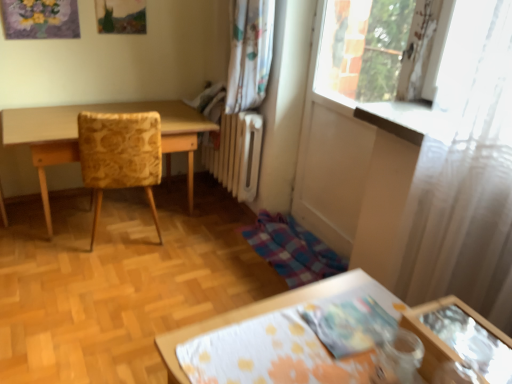
In order to face white sheer curtain at right, should I rotate leftwards or rightwards?

Turn right by 26.500 degrees to look at white sheer curtain at right.

Find the location of a particular element. The width and height of the screenshot is (512, 384). light wood table at left is located at coordinates (77, 135).

This screenshot has height=384, width=512. What are the coordinates of `yellow floral fabric chair at left` in the screenshot? It's located at (120, 154).

Considering the relative sizes of yellow floral fabric chair at left and white sheer curtain at right in the image provided, is yellow floral fabric chair at left thinner than white sheer curtain at right?

Incorrect, the width of yellow floral fabric chair at left is not less than that of white sheer curtain at right.

Which is closer, [152,153] or [510,92]?

Positioned in front is point [510,92].

Is yellow floral fabric chair at left facing towards white sheer curtain at right?

No, yellow floral fabric chair at left is not oriented towards white sheer curtain at right.

Which is correct: yellow floral fabric chair at left is inside white sheer curtain at right, or outside of it?

yellow floral fabric chair at left is spatially situated outside white sheer curtain at right.

From the image's perspective, is yellow floral fabric chair at left above or below light wood table at left?

Clearly, from the image's perspective, yellow floral fabric chair at left is below light wood table at left.

Is yellow floral fabric chair at left to the left of light wood table at left from the viewer's perspective?

No, yellow floral fabric chair at left is not to the left of light wood table at left.

Does point (155, 126) come in front of point (179, 131)?

That is True.

Is yellow floral fabric chair at left aimed at light wood table at left?

Yes, yellow floral fabric chair at left is facing light wood table at left.

Which of these two, light wood table at left or yellow floral fabric chair at left, is smaller?

yellow floral fabric chair at left.

The image size is (512, 384). There is a light wood table at left. Identify the location of chair above it (from a real-world perspective). (120, 154).

Could you tell me if light wood table at left is facing yellow floral fabric chair at left?

Yes, light wood table at left is aimed at yellow floral fabric chair at left.

Is white sheer curtain at right looking in the opposite direction of yellow floral fabric chair at left?

No.

Can you tell me how much white sheer curtain at right and yellow floral fabric chair at left differ in facing direction?

101 degrees.

Does white sheer curtain at right touch yellow floral fabric chair at left?

No, white sheer curtain at right is not touching yellow floral fabric chair at left.

Is light wood table at left positioned with its back to white sheer curtain at right?

No, light wood table at left is not facing away from white sheer curtain at right.

Which object is positioned more to the left, light wood table at left or white sheer curtain at right?

Positioned to the left is light wood table at left.

Do you think light wood table at left is within white sheer curtain at right, or outside of it?

light wood table at left lies outside white sheer curtain at right.

Would you say light wood table at left is a long distance from white sheer curtain at right?

light wood table at left is positioned a significant distance from white sheer curtain at right.

Does point (419, 249) come closer to viewer compared to point (55, 128)?

Yes, it is in front of point (55, 128).

Is white sheer curtain at right outside of light wood table at left?

That's correct, white sheer curtain at right is outside of light wood table at left.

Considering the positions of objects white sheer curtain at right and light wood table at left in the image provided, who is more to the right, white sheer curtain at right or light wood table at left?

white sheer curtain at right.

From a real-world perspective, between white sheer curtain at right and light wood table at left, who is vertically lower?

In real-world perspective, light wood table at left is lower.

Find the location of `chair on the left of white sheer curtain at right`. chair on the left of white sheer curtain at right is located at coordinates (120, 154).

Where is `table above the yellow floral fabric chair at left (from the image's perspective)`? The width and height of the screenshot is (512, 384). table above the yellow floral fabric chair at left (from the image's perspective) is located at coordinates (77, 135).

When comparing their distances from white sheer curtain at right, does yellow floral fabric chair at left or light wood table at left seem further?

The object further to white sheer curtain at right is light wood table at left.

Looking at the image, which one is located further to white sheer curtain at right, light wood table at left or yellow floral fabric chair at left?

light wood table at left is further to white sheer curtain at right.

Looking at the image, which one is located further to yellow floral fabric chair at left, light wood table at left or white sheer curtain at right?

The object further to yellow floral fabric chair at left is white sheer curtain at right.

Estimate the real-world distances between objects in this image. Which object is closer to light wood table at left, yellow floral fabric chair at left or white sheer curtain at right?

yellow floral fabric chair at left is closer to light wood table at left.

Considering their positions, is white sheer curtain at right positioned further to light wood table at left than yellow floral fabric chair at left?

white sheer curtain at right is further to light wood table at left.

From the image, which object appears to be nearer to yellow floral fabric chair at left, white sheer curtain at right or light wood table at left?

light wood table at left is closer to yellow floral fabric chair at left.

Locate an element on the screen. chair between light wood table at left and white sheer curtain at right in the horizontal direction is located at coordinates (120, 154).